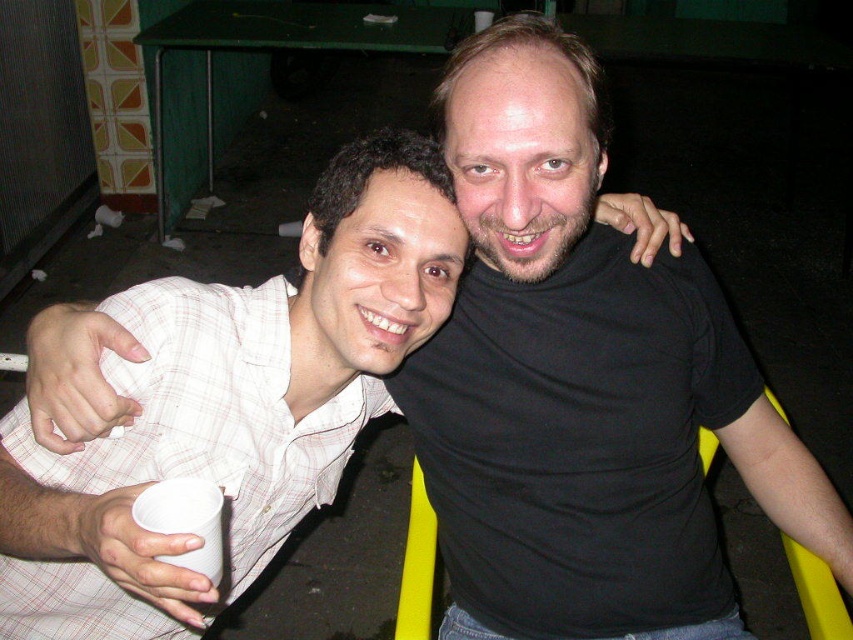
Does black matte shirt at upper right lie behind white checkered shirt at left?

No, it is not.

Does black matte shirt at upper right have a larger size compared to white checkered shirt at left?

Indeed, black matte shirt at upper right has a larger size compared to white checkered shirt at left.

Image resolution: width=853 pixels, height=640 pixels. What are the coordinates of `black matte shirt at upper right` in the screenshot? It's located at (583, 384).

Find the location of a particular element. The image size is (853, 640). black matte shirt at upper right is located at coordinates click(x=583, y=384).